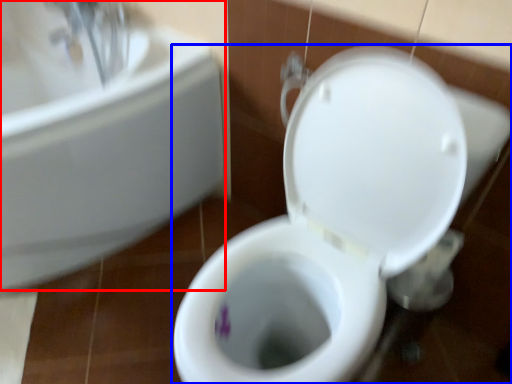
Question: Which of the following is the farthest to the observer, sink (highlighted by a red box) or toilet (highlighted by a blue box)?

Choices:
 (A) sink
 (B) toilet

Answer: (A)